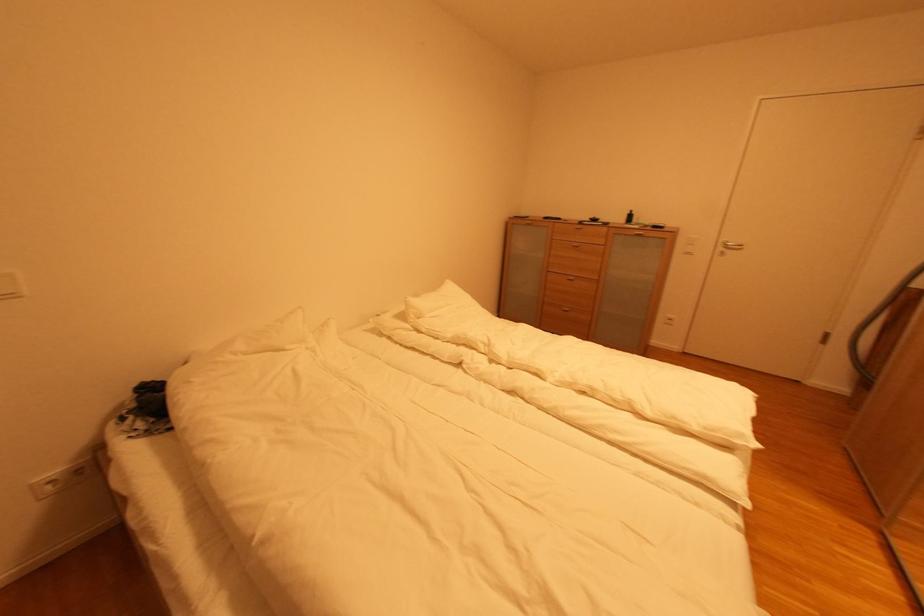
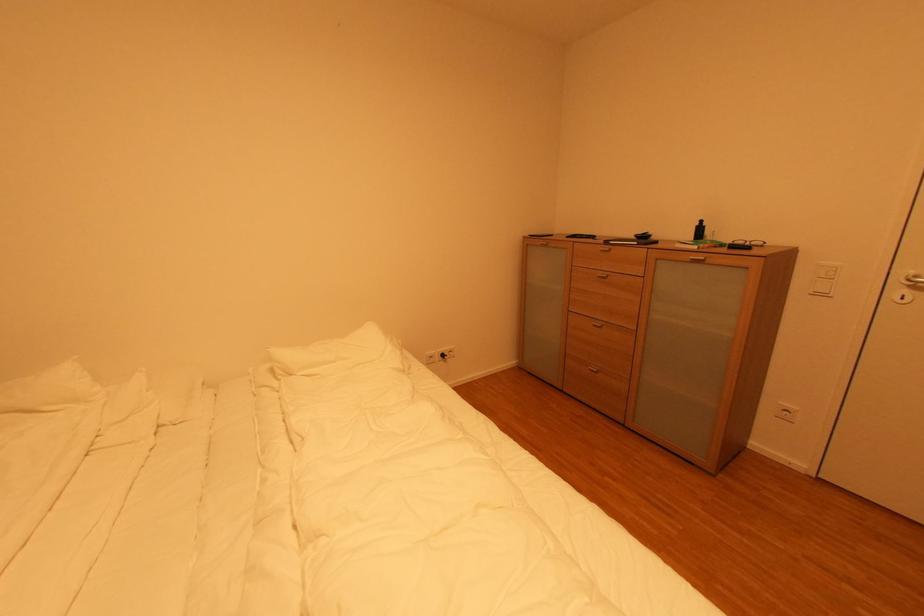
What movement of the cameraman would produce the second image?

The movement direction of the cameraman is right, forward.